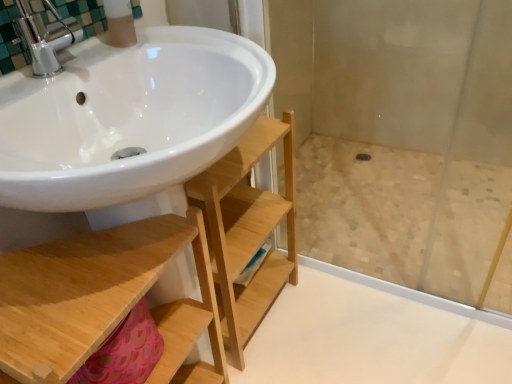
Question: Can you confirm if matte plastic soap dispenser at upper left is smaller than natural wood shelf at lower left?

Choices:
 (A) no
 (B) yes

Answer: (B)

Question: Is matte plastic soap dispenser at upper left completely or partially outside of natural wood shelf at lower left?

Choices:
 (A) yes
 (B) no

Answer: (A)

Question: Is matte plastic soap dispenser at upper left positioned far away from natural wood shelf at lower left?

Choices:
 (A) yes
 (B) no

Answer: (B)

Question: Is matte plastic soap dispenser at upper left to the right of natural wood shelf at lower left from the viewer's perspective?

Choices:
 (A) yes
 (B) no

Answer: (A)

Question: Does matte plastic soap dispenser at upper left have a greater width compared to natural wood shelf at lower left?

Choices:
 (A) no
 (B) yes

Answer: (A)

Question: Is matte plastic soap dispenser at upper left in front of natural wood shelf at lower left?

Choices:
 (A) no
 (B) yes

Answer: (A)

Question: Is natural wood shelf at lower left completely or partially inside transparent glass shower door at center?

Choices:
 (A) no
 (B) yes

Answer: (A)

Question: Can you confirm if transparent glass shower door at center is shorter than natural wood shelf at lower left?

Choices:
 (A) no
 (B) yes

Answer: (B)

Question: Considering the relative positions of transparent glass shower door at center and natural wood shelf at lower left in the image provided, is transparent glass shower door at center to the left of natural wood shelf at lower left from the viewer's perspective?

Choices:
 (A) yes
 (B) no

Answer: (B)

Question: Is transparent glass shower door at center not near natural wood shelf at lower left?

Choices:
 (A) no
 (B) yes

Answer: (A)

Question: Is transparent glass shower door at center facing away from natural wood shelf at lower left?

Choices:
 (A) yes
 (B) no

Answer: (B)

Question: From the image's perspective, is transparent glass shower door at center beneath natural wood shelf at lower left?

Choices:
 (A) yes
 (B) no

Answer: (B)

Question: Is natural wood shelf at lower left touching matte plastic soap dispenser at upper left?

Choices:
 (A) yes
 (B) no

Answer: (B)